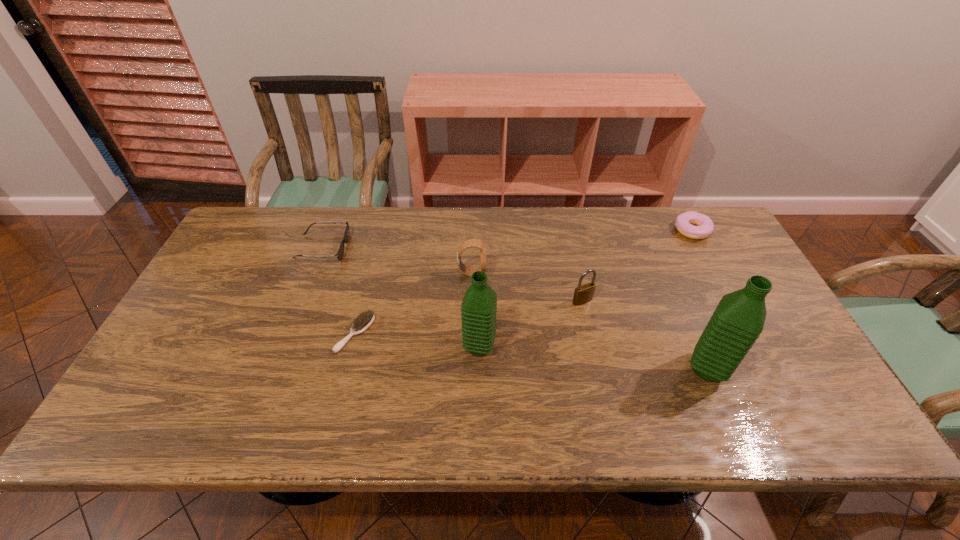
Please point out where to position a new water bottle on the left to maintain spacing. Please provide its 2D coordinates. Your answer should be formatted as a tuple, i.e. [(x, y)], where the tuple contains the x and y coordinates of a point satisfying the conditions above.

[(270, 326)]